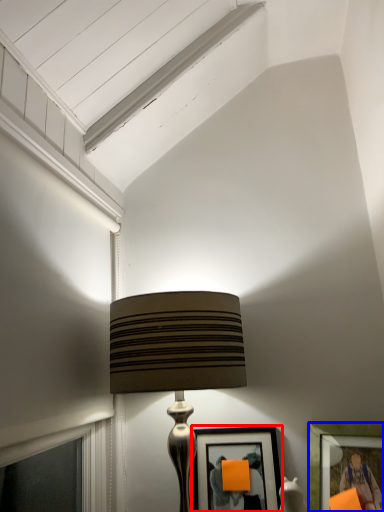
Question: Which object appears farthest to the camera in this image, picture frame (highlighted by a red box) or picture frame (highlighted by a blue box)?

Choices:
 (A) picture frame
 (B) picture frame

Answer: (A)